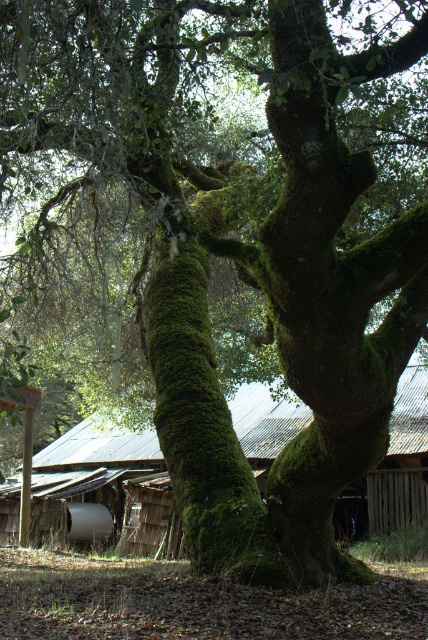
Question: Is rusty corrugated metal hut at center wider than green mossy tree trunk at center?

Choices:
 (A) no
 (B) yes

Answer: (B)

Question: Does rusty corrugated metal hut at center lie behind green mossy tree trunk at center?

Choices:
 (A) no
 (B) yes

Answer: (B)

Question: Can you confirm if rusty corrugated metal hut at center is smaller than green mossy tree trunk at center?

Choices:
 (A) no
 (B) yes

Answer: (A)

Question: Which object is farther from the camera taking this photo?

Choices:
 (A) rusty corrugated metal hut at center
 (B) green mossy tree trunk at center

Answer: (A)

Question: Which object appears farthest from the camera in this image?

Choices:
 (A) green mossy tree trunk at center
 (B) rusty corrugated metal hut at center

Answer: (B)